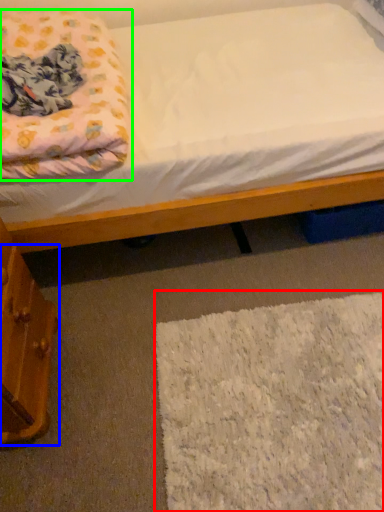
Question: Which object is positioned farthest from mat (highlighted by a red box)? Select from drawer (highlighted by a blue box) and blanket (highlighted by a green box).

Choices:
 (A) drawer
 (B) blanket

Answer: (B)